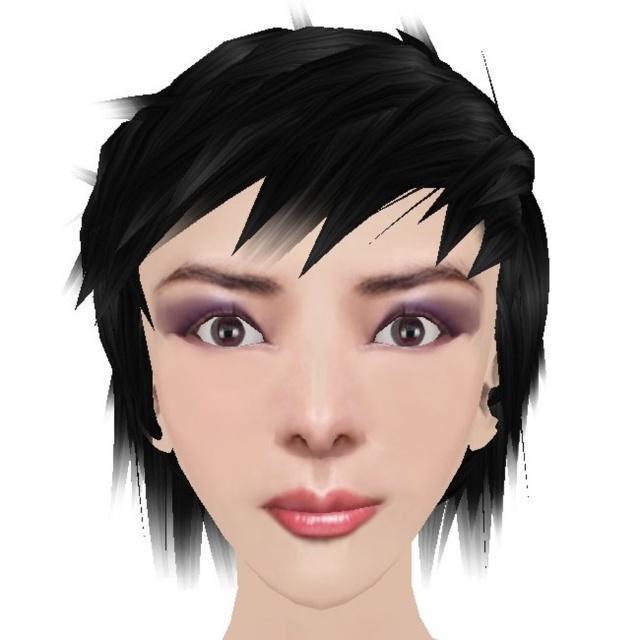
Can you confirm if purple matte eye at center is positioned below dark brown hair at upper center?

Yes.

Which is more to the left, purple matte eye at center or dark brown hair at upper center?

Positioned to the left is purple matte eye at center.

Who is more distant from viewer, (420, 310) or (388, 273)?

Positioned behind is point (420, 310).

Where is `purple matte eye at center`? purple matte eye at center is located at coordinates (417, 324).

Who is positioned more to the right, smooth skin face at center or dark brown eyebrow at upper center?

smooth skin face at center

Describe the element at coordinates (317, 397) in the screenshot. I see `smooth skin face at center` at that location.

Find the location of a particular element. smooth skin face at center is located at coordinates (317, 397).

Is point (308, 324) positioned behind point (451, 321)?

No, (308, 324) is closer to viewer.

Is smooth skin face at center to the left of purple matte eye at center from the viewer's perspective?

Indeed, smooth skin face at center is positioned on the left side of purple matte eye at center.

Locate an element on the screen. smooth skin face at center is located at coordinates (317, 397).